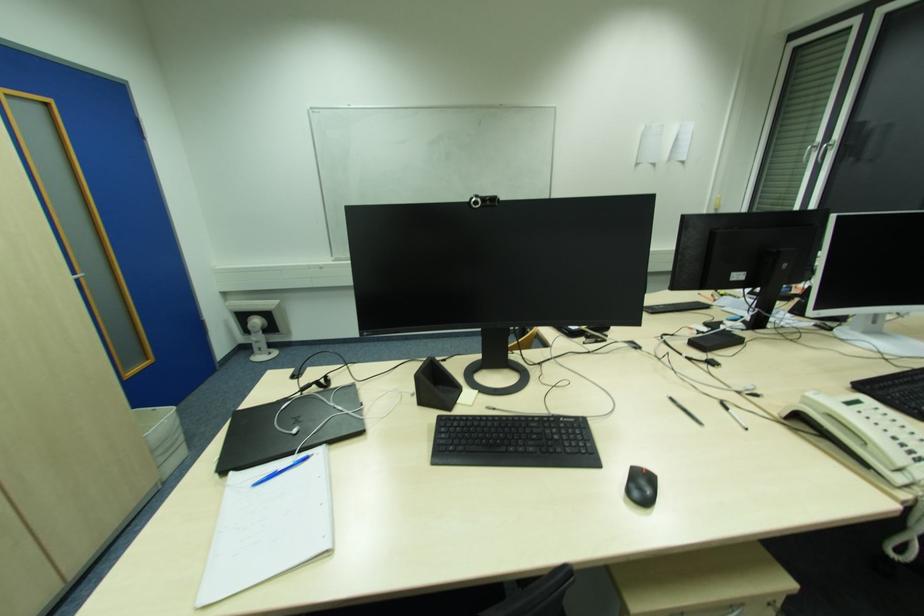
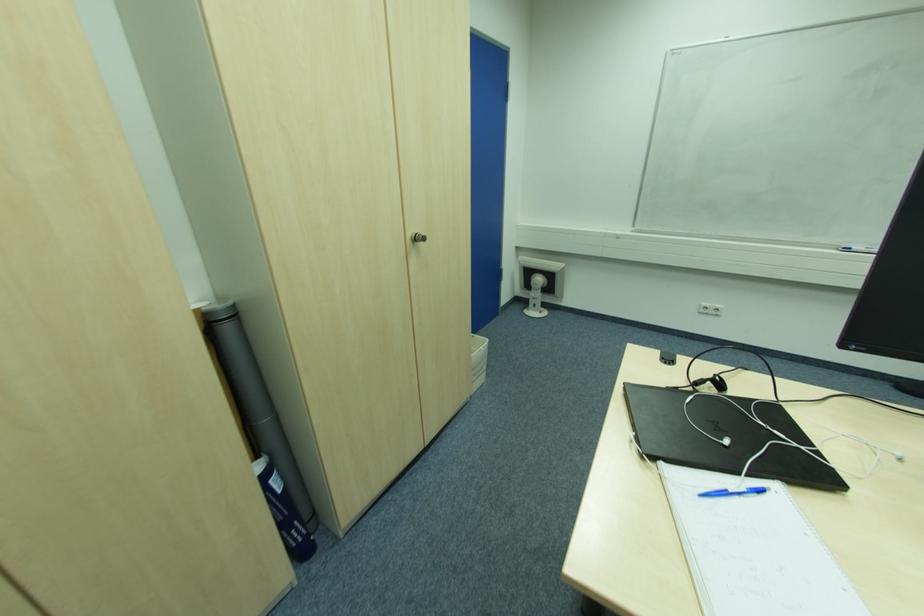
Question: The camera is either moving clockwise (left) or counter-clockwise (right) around the object. The first image is from the beginning of the video and the second image is from the end. Is the camera moving left or right when shooting the video?

Choices:
 (A) Left
 (B) Right

Answer: (B)